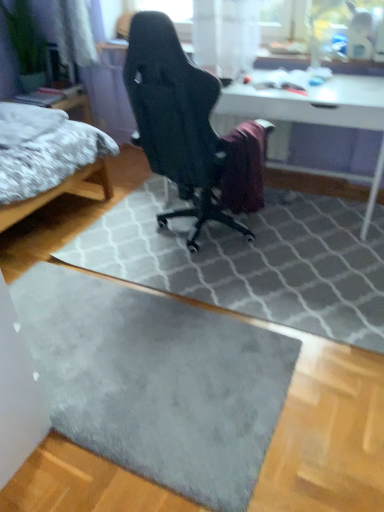
Question: Is white glossy table at center thinner than gray fluffy bed at left?

Choices:
 (A) no
 (B) yes

Answer: (B)

Question: From a real-world perspective, is white glossy table at center located higher than gray fluffy bed at left?

Choices:
 (A) no
 (B) yes

Answer: (A)

Question: Is white glossy table at center turned away from gray fluffy bed at left?

Choices:
 (A) yes
 (B) no

Answer: (B)

Question: Considering the relative sizes of white glossy table at center and gray fluffy bed at left in the image provided, is white glossy table at center bigger than gray fluffy bed at left?

Choices:
 (A) no
 (B) yes

Answer: (A)

Question: Is white glossy table at center positioned in front of gray fluffy bed at left?

Choices:
 (A) no
 (B) yes

Answer: (A)

Question: Considering their positions, is white glossy table at center located in front of or behind black mesh chair at center?

Choices:
 (A) behind
 (B) front

Answer: (A)

Question: Considering the relative positions of white glossy table at center and black mesh chair at center in the image provided, is white glossy table at center to the left or to the right of black mesh chair at center?

Choices:
 (A) left
 (B) right

Answer: (B)

Question: Looking at the image, does white glossy table at center seem bigger or smaller compared to black mesh chair at center?

Choices:
 (A) small
 (B) big

Answer: (B)

Question: From the image's perspective, is white glossy table at center above or below black mesh chair at center?

Choices:
 (A) above
 (B) below

Answer: (A)

Question: Looking at their shapes, would you say black mesh chair at center is wider or thinner than gray fluffy bed at left?

Choices:
 (A) thin
 (B) wide

Answer: (A)

Question: In the image, is black mesh chair at center on the left side or the right side of gray fluffy bed at left?

Choices:
 (A) right
 (B) left

Answer: (A)

Question: Looking at the image, does black mesh chair at center seem bigger or smaller compared to gray fluffy bed at left?

Choices:
 (A) small
 (B) big

Answer: (A)

Question: Considering their positions, is black mesh chair at center located in front of or behind gray fluffy bed at left?

Choices:
 (A) behind
 (B) front

Answer: (B)

Question: Would you say gray fluffy bed at left is to the left or to the right of black mesh chair at center in the picture?

Choices:
 (A) left
 (B) right

Answer: (A)

Question: Looking at their shapes, would you say gray fluffy bed at left is wider or thinner than black mesh chair at center?

Choices:
 (A) wide
 (B) thin

Answer: (A)